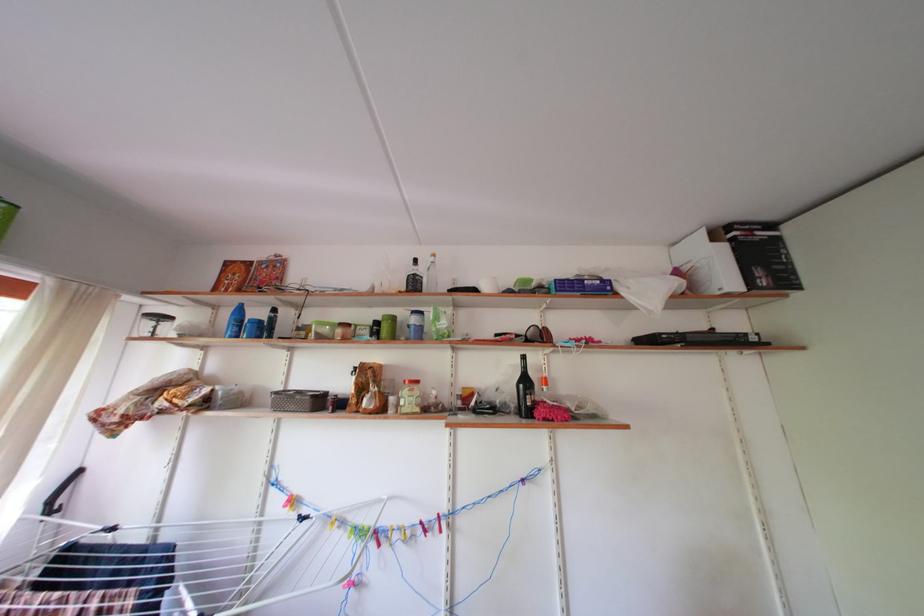
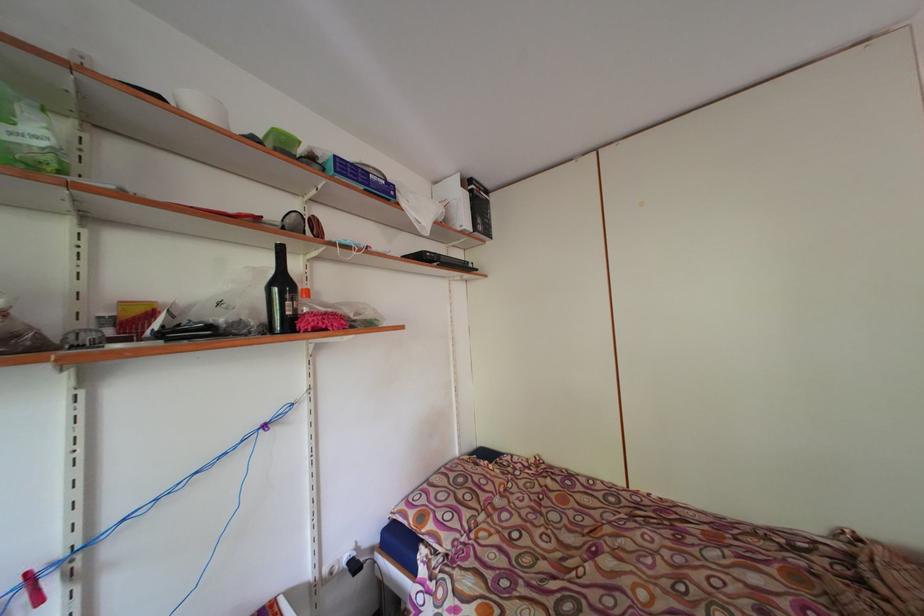
Where in the second image is the point corresponding to point 537,339 from the first image?

(296, 227)